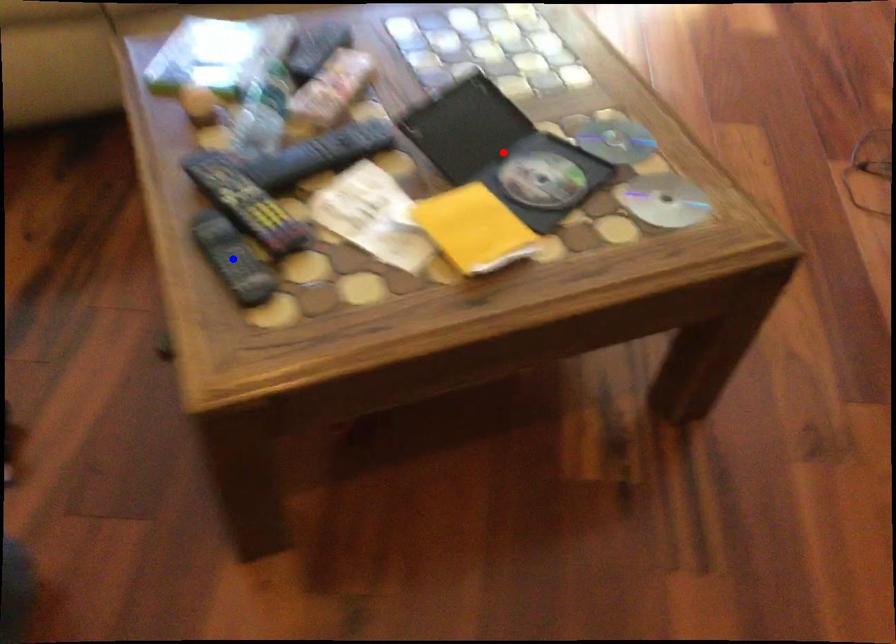
Question: Which of the two points in the image is closer to the camera?

Choices:
 (A) Blue point is closer.
 (B) Red point is closer.

Answer: (A)